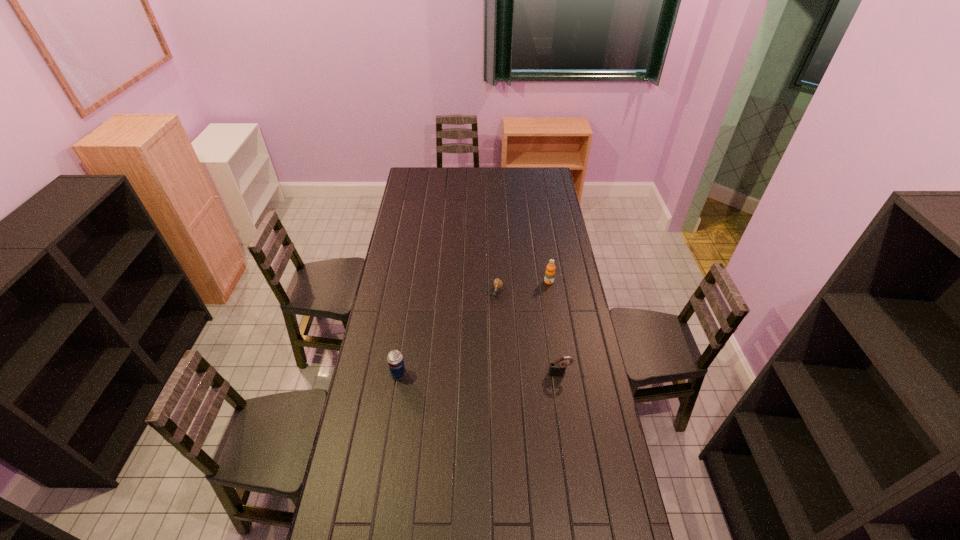
Locate which object is the closest to the orange juice. Please provide its 2D coordinates. Your answer should be formatted as a tuple, i.e. [(x, y)], where the tuple contains the x and y coordinates of a point satisfying the conditions above.

[(498, 284)]

The image size is (960, 540). I want to click on object that is the closest to the padlock, so click(498, 284).